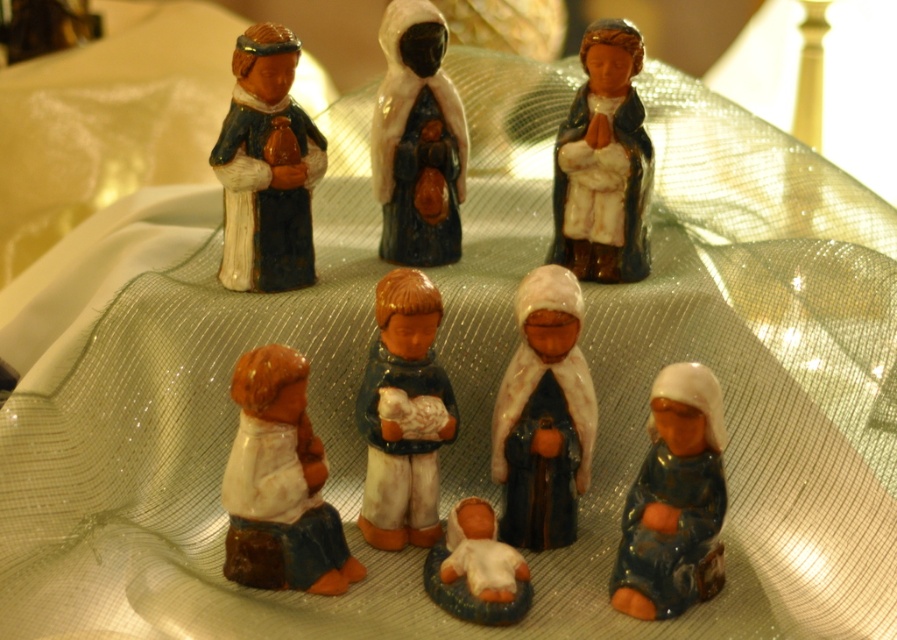
You are an art curator arranging a display of these nativity figurines. You need to place a new golden star decoration exactly at the point marked by the coordinates point (603, 163). Based on the scene description, which existing figurine will the golden star decoration be placed near?

The golden star decoration will be placed near the matte blue figurine at upper right, as the coordinates point (603, 163) indicate that location.